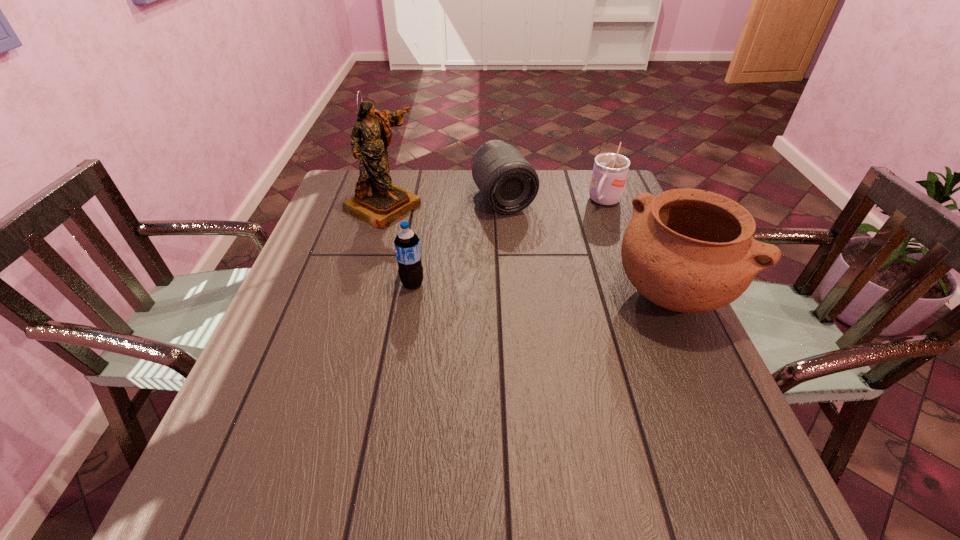
I want to click on free spot between the figurine and the fourth shortest object, so [527, 250].

Identify the location of vacant area between the figurine and the pottery. (527, 250).

The height and width of the screenshot is (540, 960). I want to click on vacant region between the cup and the soda bottle, so click(x=509, y=243).

Image resolution: width=960 pixels, height=540 pixels. Identify the location of unoccupied position between the soda bottle and the cup. (509, 243).

Locate an element on the screen. vacant area that lies between the third object from left to right and the cup is located at coordinates (554, 201).

The image size is (960, 540). Find the location of `free space that is in between the pottery and the tallest object`. free space that is in between the pottery and the tallest object is located at coordinates pyautogui.click(x=527, y=250).

Where is `free point between the soda bottle and the cup`? The image size is (960, 540). free point between the soda bottle and the cup is located at coordinates (509, 243).

Find the location of a particular element. vacant point located between the soda bottle and the pottery is located at coordinates (541, 289).

What are the coordinates of `object that is the third closest to the cup` in the screenshot? It's located at (377, 201).

Identify the location of object that is the third closest to the figurine. Image resolution: width=960 pixels, height=540 pixels. (687, 250).